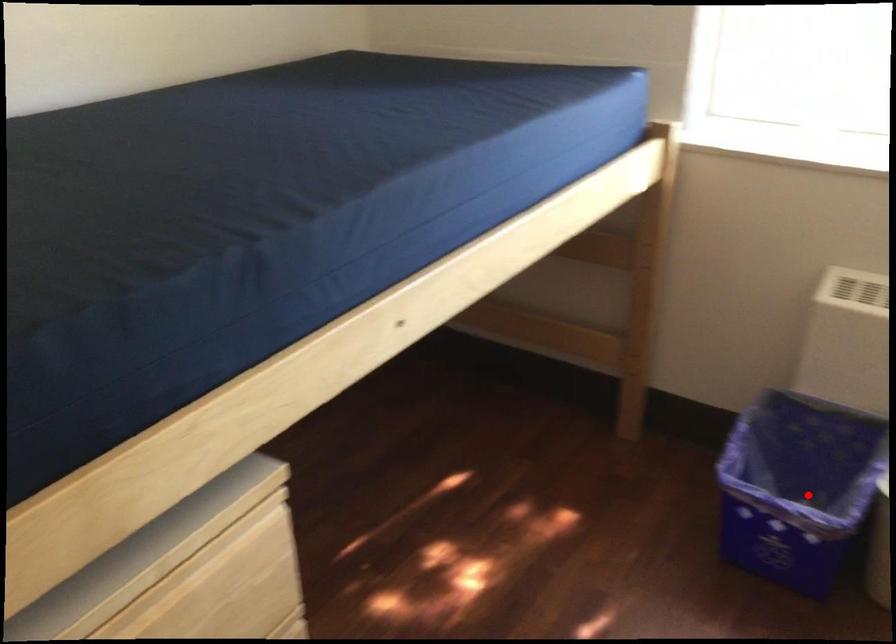
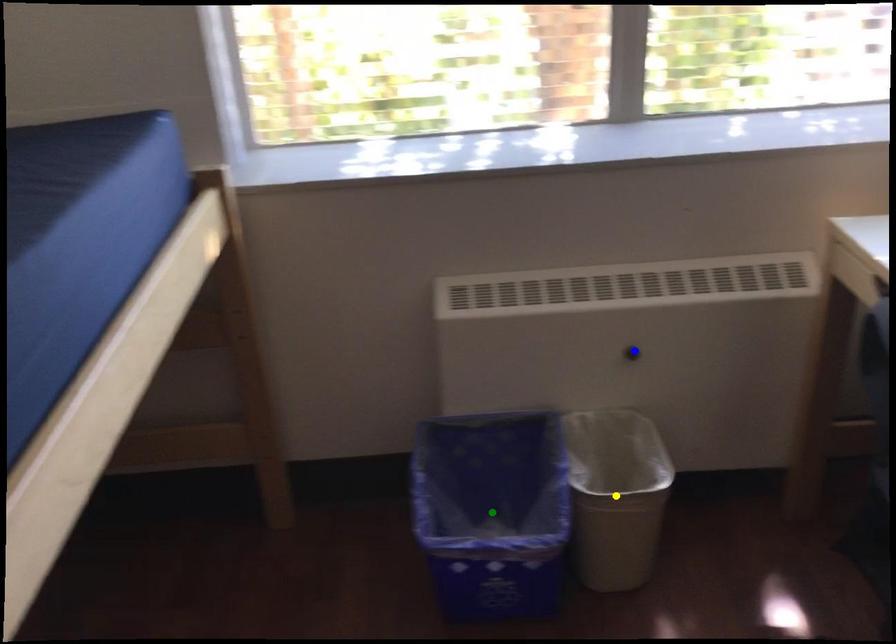
Question: I am providing you with two images of the same scene from different viewpoints. A red point is marked on the first image. You are given multiple points on the second image. In image 2, which mark is for the same physical point as the one in image 1?

Choices:
 (A) green point
 (B) yellow point
 (C) blue point

Answer: (A)